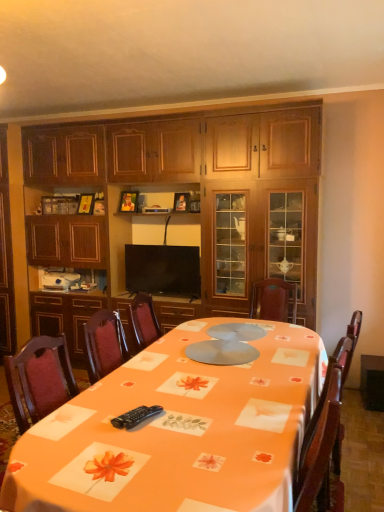
Locate an element on the screen. The image size is (384, 512). free space in front of black plastic remote control at lower center is located at coordinates (138, 445).